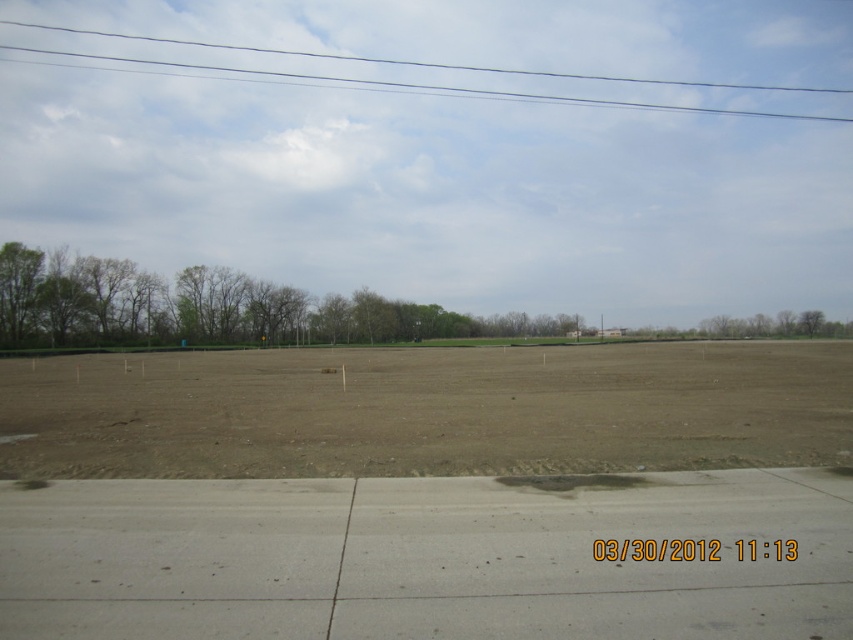
Question: Estimate the real-world distances between objects in this image. Which object is farther from the clear wire at upper center?

Choices:
 (A) green leafy trees at left
 (B) gray concrete pavement at bottom
 (C) brown/dry soil at center

Answer: (B)

Question: Does brown/dry soil at center lie in front of clear wire at upper center?

Choices:
 (A) yes
 (B) no

Answer: (A)

Question: Which object is positioned closest to the gray concrete pavement at bottom?

Choices:
 (A) brown/dry soil at center
 (B) green leafy trees at left

Answer: (A)

Question: Among these objects, which one is farthest from the camera?

Choices:
 (A) green leafy trees at left
 (B) gray concrete pavement at bottom
 (C) brown/dry soil at center

Answer: (A)

Question: Where is brown/dry soil at center located in relation to clear wire at upper center in the image?

Choices:
 (A) below
 (B) above

Answer: (A)

Question: From the image, what is the correct spatial relationship of brown/dry soil at center in relation to green leafy trees at left?

Choices:
 (A) below
 (B) above

Answer: (A)